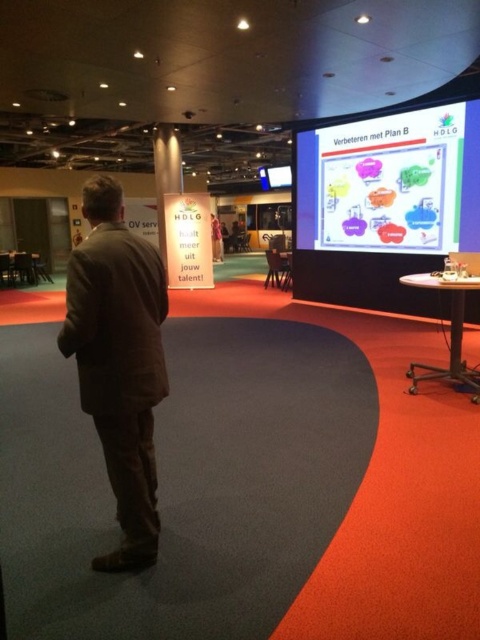
Question: From the image, what is the correct spatial relationship of brown fabric suit at left in relation to whiteboard at upper center?

Choices:
 (A) right
 (B) left

Answer: (B)

Question: Is brown fabric suit at left bigger than whiteboard at upper center?

Choices:
 (A) yes
 (B) no

Answer: (B)

Question: Which point is farther to the camera?

Choices:
 (A) (x=415, y=188)
 (B) (x=117, y=288)

Answer: (A)

Question: Is brown fabric suit at left above whiteboard at upper center?

Choices:
 (A) yes
 (B) no

Answer: (B)